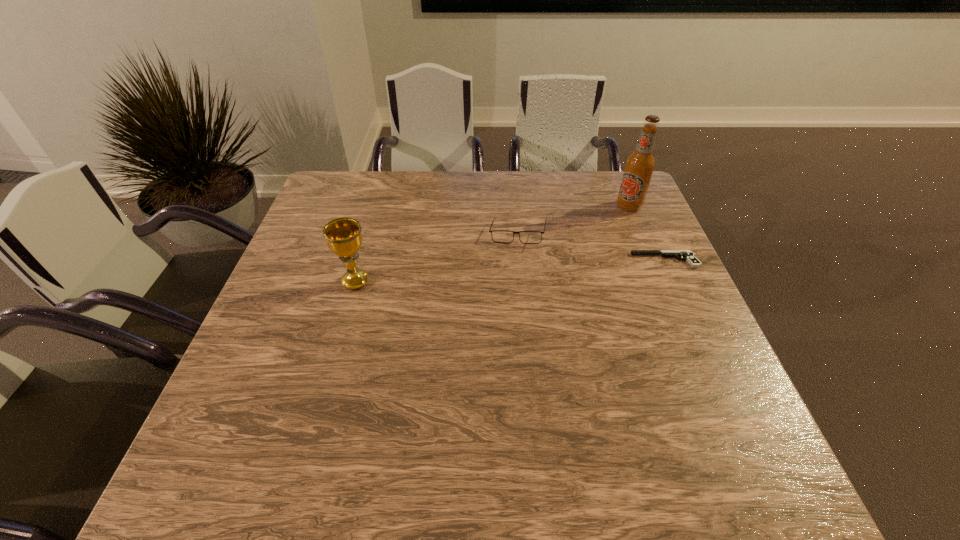
You are a GUI agent. You are given a task and a screenshot of the screen. Output one action in this format:
    pyautogui.click(x=<x>, y=<y>)
    Task: Click on the vacant area situated 0.050m on the front-facing side of the shortest object
    This screenshot has height=540, width=960.
    Given the screenshot: What is the action you would take?
    pyautogui.click(x=614, y=260)

Where is `vacant position located 0.140m on the front-facing side of the shortest object`? vacant position located 0.140m on the front-facing side of the shortest object is located at coordinates (580, 260).

Image resolution: width=960 pixels, height=540 pixels. Find the location of `free location located 0.230m with the lenses facing outward on the third nearest object`. free location located 0.230m with the lenses facing outward on the third nearest object is located at coordinates (444, 293).

Identify the location of vacant area situated 0.120m with the lenses facing outward on the third nearest object. The image size is (960, 540). pos(473,268).

Where is `vacant space located 0.210m with the lenses facing outward on the third nearest object`? vacant space located 0.210m with the lenses facing outward on the third nearest object is located at coordinates (450, 288).

Where is `vacant space located on the front label of the farthest object`? vacant space located on the front label of the farthest object is located at coordinates (531, 256).

You are a GUI agent. You are given a task and a screenshot of the screen. Output one action in this format:
    pyautogui.click(x=<x>, y=<y>)
    Task: Click on the blank space located on the front label of the farthest object
    
    Given the screenshot: What is the action you would take?
    pyautogui.click(x=516, y=263)

Identify the location of free location located 0.290m on the front label of the farthest object. The width and height of the screenshot is (960, 540). (548, 247).

At what (x,y) coordinates should I click in order to perform the action: click on object that is positioned at the far edge. Please return your answer as a coordinate pair (x, y). The width and height of the screenshot is (960, 540). Looking at the image, I should click on (639, 166).

I want to click on object at the left edge, so click(x=343, y=236).